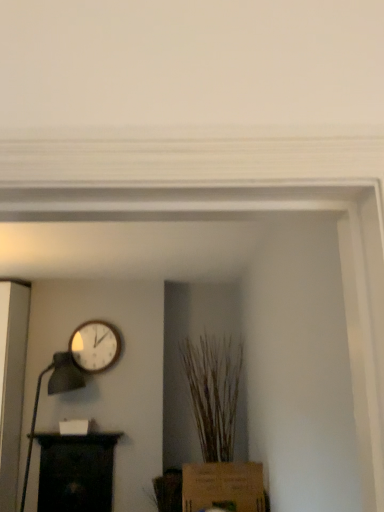
What is the approximate width of brown textured plant at center?

22.68 inches.

What do you see at coordinates (214, 392) in the screenshot? I see `brown textured plant at center` at bounding box center [214, 392].

What do you see at coordinates (76, 472) in the screenshot?
I see `black wood shelf at lower left` at bounding box center [76, 472].

Where is `brown cardboard box at lower center`? This screenshot has width=384, height=512. brown cardboard box at lower center is located at coordinates (223, 487).

Does brown textured plant at center come in front of wooden wall clock at upper left?

Yes, brown textured plant at center is closer to the viewer.

Would you say brown textured plant at center is inside or outside wooden wall clock at upper left?

The correct answer is: outside.

In terms of width, does brown textured plant at center look wider or thinner when compared to wooden wall clock at upper left?

In the image, brown textured plant at center appears to be wider than wooden wall clock at upper left.

From a real-world perspective, which is physically below, brown textured plant at center or wooden wall clock at upper left?

In real-world perspective, brown textured plant at center is lower.

Is matte black table lamp at left taller than brown textured plant at center?

No, matte black table lamp at left is not taller than brown textured plant at center.

Is matte black table lamp at left located outside brown textured plant at center?

Yes.

Are matte black table lamp at left and brown textured plant at center beside each other?

No, matte black table lamp at left is not with brown textured plant at center.

Does point (64, 380) appear closer or farther from the camera than point (230, 362)?

Clearly, point (64, 380) is closer to the camera than point (230, 362).

Does brown textured plant at center turn towards black wood shelf at lower left?

No, brown textured plant at center is not facing towards black wood shelf at lower left.

Is point (220, 387) farther from viewer compared to point (88, 493)?

Yes, point (220, 387) is behind point (88, 493).

Find the location of a particular element. This screenshot has height=512, width=384. plant in front of the black wood shelf at lower left is located at coordinates (214, 392).

From a real-world perspective, between brown textured plant at center and black wood shelf at lower left, who is vertically higher?

brown textured plant at center.

In the scene shown: Would you say brown textured plant at center is inside or outside matte black table lamp at left?

brown textured plant at center is not inside matte black table lamp at left, it's outside.

Is point (188, 362) positioned after point (33, 424)?

Yes, it is behind point (33, 424).

Which of these two, brown textured plant at center or matte black table lamp at left, stands shorter?

matte black table lamp at left is shorter.

Is there a large distance between brown textured plant at center and matte black table lamp at left?

Yes, brown textured plant at center is far from matte black table lamp at left.

Can you confirm if brown textured plant at center is thinner than brown cardboard box at lower center?

Correct, the width of brown textured plant at center is less than that of brown cardboard box at lower center.

Is brown cardboard box at lower center located within brown textured plant at center?

No, brown cardboard box at lower center is not surrounded by brown textured plant at center.

Between brown textured plant at center and brown cardboard box at lower center, which one has less height?

Standing shorter between the two is brown cardboard box at lower center.

From the image's perspective, which object appears higher, brown textured plant at center or brown cardboard box at lower center?

brown textured plant at center, from the image's perspective.

Does point (110, 364) lie behind point (225, 471)?

That is True.

In the scene shown: Would you say wooden wall clock at upper left is outside brown cardboard box at lower center?

Absolutely, wooden wall clock at upper left is external to brown cardboard box at lower center.

Where is `wall clock on the left of the brown cardboard box at lower center`? Image resolution: width=384 pixels, height=512 pixels. wall clock on the left of the brown cardboard box at lower center is located at coordinates (95, 346).

How different are the orientations of wooden wall clock at upper left and brown cardboard box at lower center in degrees?

There is a 90.9-degree angle between the facing directions of wooden wall clock at upper left and brown cardboard box at lower center.

How distant is brown cardboard box at lower center from black wood shelf at lower left?

4.42 feet.

In the scene shown: Does brown cardboard box at lower center have a greater height compared to black wood shelf at lower left?

No, brown cardboard box at lower center is not taller than black wood shelf at lower left.

From the image's perspective, which one is positioned lower, brown cardboard box at lower center or black wood shelf at lower left?

black wood shelf at lower left.

Is brown cardboard box at lower center bigger than black wood shelf at lower left?

Yes, brown cardboard box at lower center is bigger than black wood shelf at lower left.

This screenshot has height=512, width=384. In order to click on wall clock that is above the brown textured plant at center (from a real-world perspective) in this screenshot , I will do `click(95, 346)`.

Where is `table lamp that appears behind the brown textured plant at center`? This screenshot has height=512, width=384. table lamp that appears behind the brown textured plant at center is located at coordinates click(53, 394).

When comparing their distances from brown textured plant at center, does matte black table lamp at left or wooden wall clock at upper left seem further?

The object further to brown textured plant at center is matte black table lamp at left.

Based on their spatial positions, is wooden wall clock at upper left or brown cardboard box at lower center further from matte black table lamp at left?

brown cardboard box at lower center is positioned further to the anchor matte black table lamp at left.

Based on their spatial positions, is brown textured plant at center or matte black table lamp at left closer to wooden wall clock at upper left?

Based on the image, matte black table lamp at left appears to be nearer to wooden wall clock at upper left.

Consider the image. Based on their spatial positions, is brown textured plant at center or black wood shelf at lower left closer to wooden wall clock at upper left?

Among the two, black wood shelf at lower left is located nearer to wooden wall clock at upper left.

When comparing their distances from black wood shelf at lower left, does brown textured plant at center or wooden wall clock at upper left seem further?

Among the two, brown textured plant at center is located further to black wood shelf at lower left.

Looking at the image, which one is located further to brown cardboard box at lower center, black wood shelf at lower left or brown textured plant at center?

black wood shelf at lower left lies further to brown cardboard box at lower center than the other object.

When comparing their distances from brown textured plant at center, does brown cardboard box at lower center or matte black table lamp at left seem closer?

Based on the image, brown cardboard box at lower center appears to be nearer to brown textured plant at center.

Based on their spatial positions, is brown textured plant at center or brown cardboard box at lower center further from wooden wall clock at upper left?

Among the two, brown cardboard box at lower center is located further to wooden wall clock at upper left.

Locate an element on the screen. This screenshot has width=384, height=512. wall clock between matte black table lamp at left and brown textured plant at center is located at coordinates (95, 346).

You are a GUI agent. You are given a task and a screenshot of the screen. Output one action in this format:
    pyautogui.click(x=<x>, y=<y>)
    Task: Click on the furniture located between matte black table lamp at left and brown textured plant at center in the left-right direction
    This screenshot has width=384, height=512.
    Given the screenshot: What is the action you would take?
    pyautogui.click(x=76, y=472)

You are a GUI agent. You are given a task and a screenshot of the screen. Output one action in this format:
    pyautogui.click(x=<x>, y=<y>)
    Task: Click on the cardboard box situated between matte black table lamp at left and brown textured plant at center from left to right
    The image size is (384, 512).
    Given the screenshot: What is the action you would take?
    pyautogui.click(x=223, y=487)

Locate an element on the screen. table lamp between wooden wall clock at upper left and black wood shelf at lower left in the up-down direction is located at coordinates (53, 394).